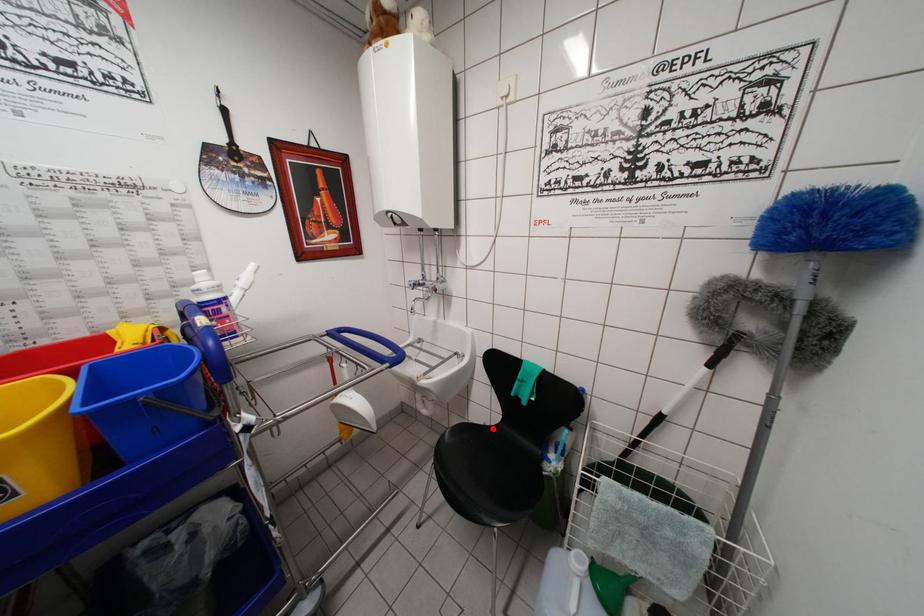
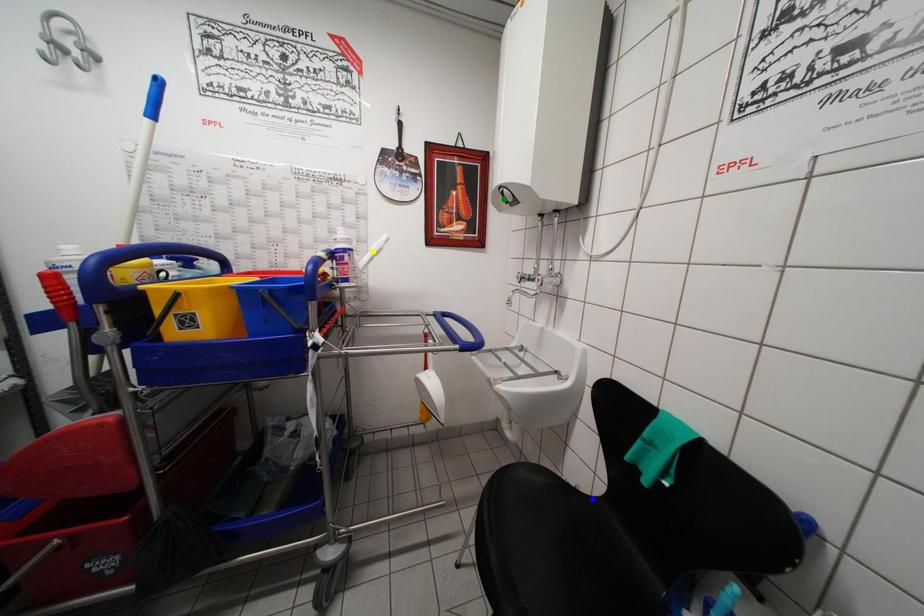
Question: I am providing you with two images of the same scene from different viewpoints. A red point is marked on the first image. You are given multiple points on the second image. Which spot in image 2 lines up with the point in image 1?

Choices:
 (A) yellow point
 (B) green point
 (C) blue point

Answer: (C)